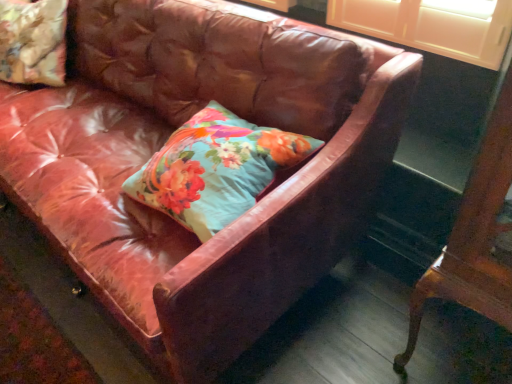
The height and width of the screenshot is (384, 512). I want to click on free point to the left of mahogany wood table at right, so click(x=362, y=344).